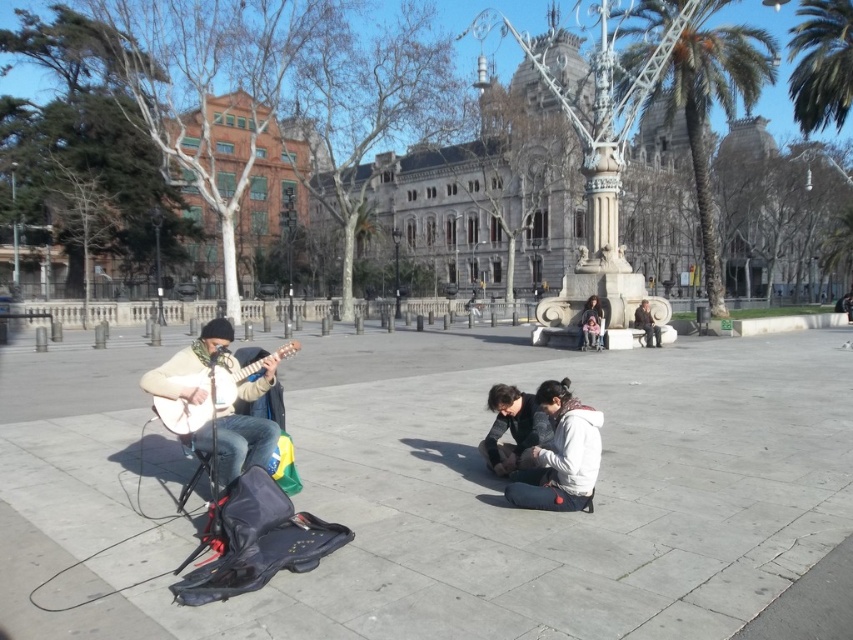
You are a street performer who just arrived at the plaza. You have a light beige fabric guitar at left and a white matte jacket at center. Which item do you need to pick up first if you want to start playing your instrument?

You should pick up the light beige fabric guitar at left first because it is your instrument, and the white matte jacket at center is just clothing. However, according to the objects description, the light beige fabric guitar at left is larger in size than the white matte jacket at center, so it might be easier to reach for the larger item first.

You are a photographer standing in the plaza and want to capture both the light beige fabric guitar at left and the white matte jacket at center in a single shot. Since you want the guitar to be visible above the jacket in the photo, does the current arrangement allow this?

Yes, the light beige fabric guitar at left is already positioned above the white matte jacket at center, so the current arrangement allows the guitar to be visible above the jacket in the photo.

Consider the image. You are a street performer who has just finished playing your guitars. You need to put both the light beige fabric guitar at left and the matte brown acoustic guitar at left into a storage case. Which guitar should you place into the case first based on their current positions?

The light beige fabric guitar at left should be placed into the case first because it is located below the matte brown acoustic guitar at left, meaning it is underneath and needs to be accessed first.